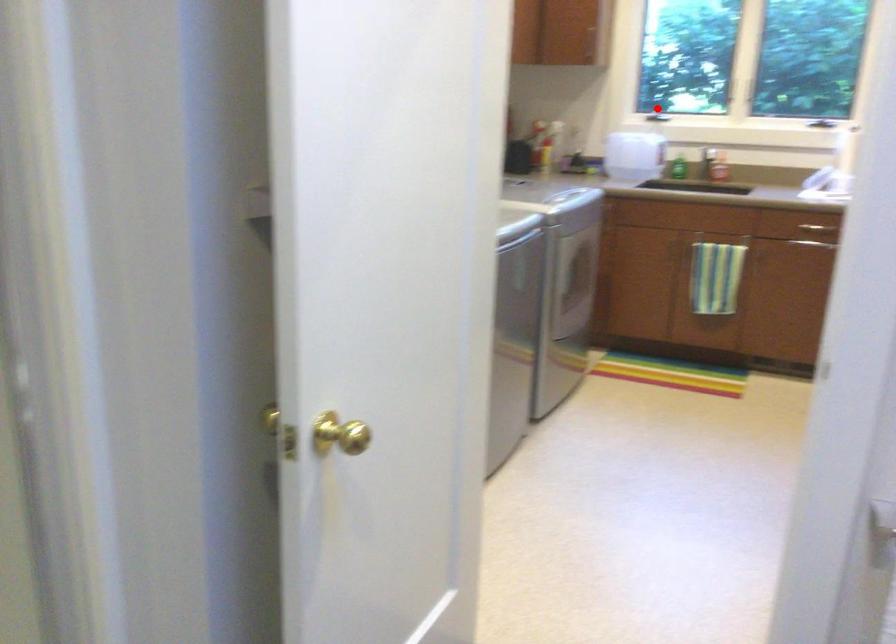
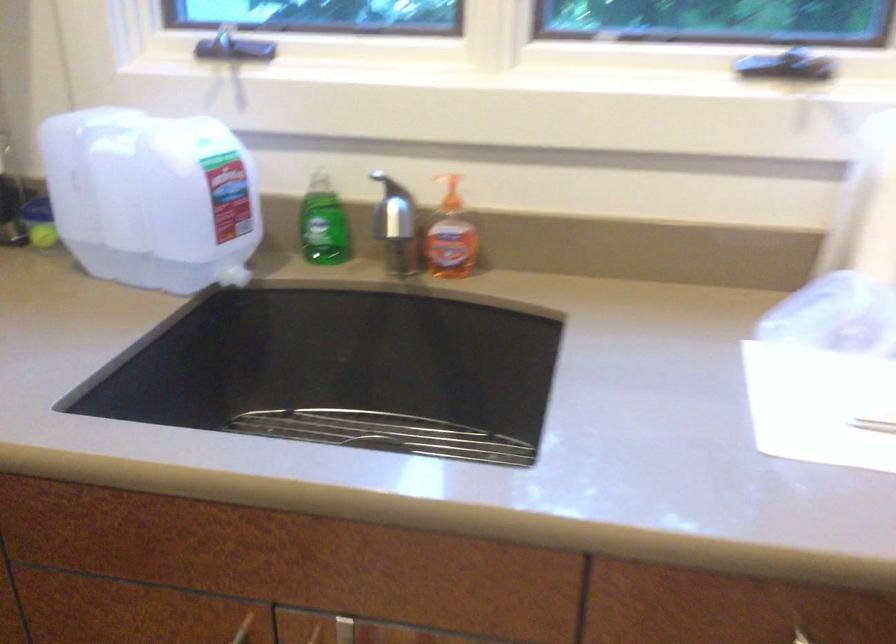
Question: I am providing you with two images of the same scene from different viewpoints. In image1, a red point is highlighted. Considering the same 3D point in image2, which of the following is correct?

Choices:
 (A) It is closer
 (B) It is farther

Answer: (A)